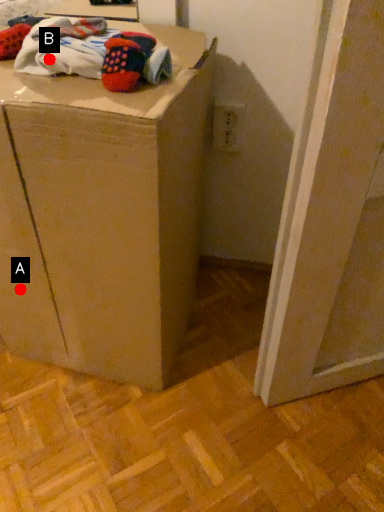
Question: Two points are circled on the image, labeled by A and B beside each circle. Which point is closer to the camera?

Choices:
 (A) A is closer
 (B) B is closer

Answer: (B)